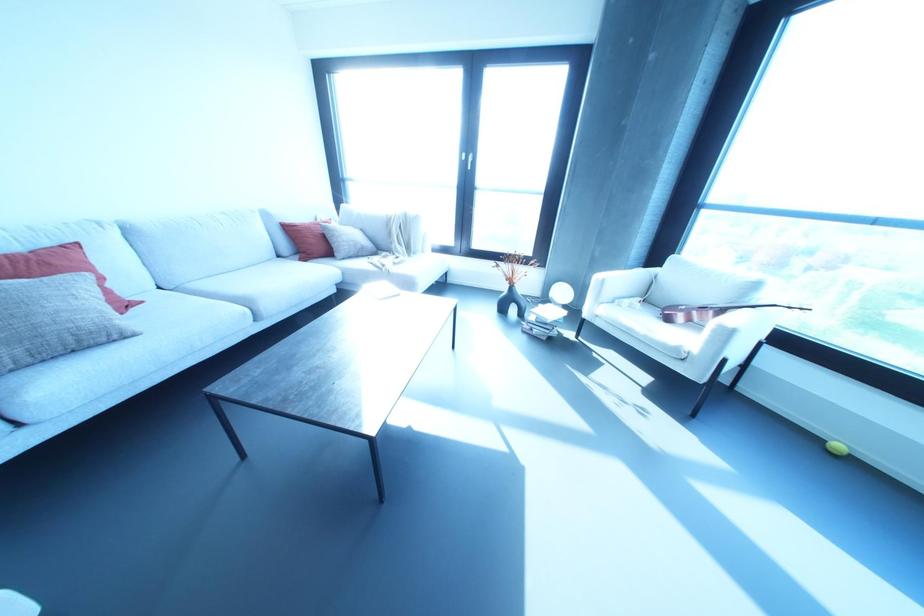
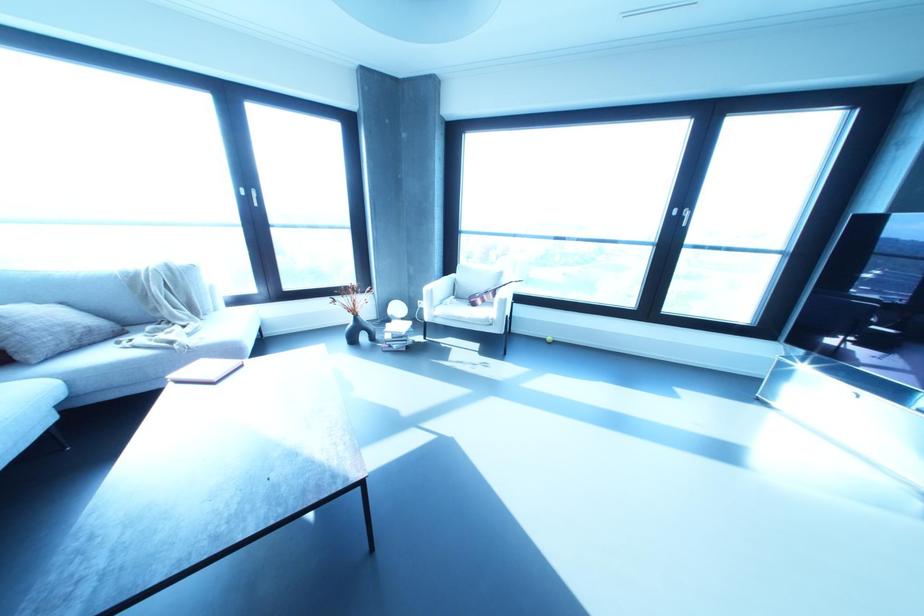
The point at [837,446] is marked in the first image. Where is the corresponding point in the second image?

(548, 338)